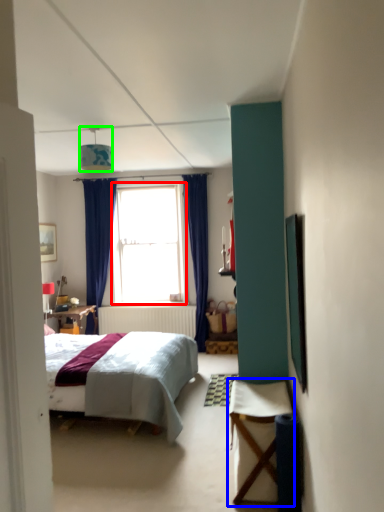
Question: Which object is the farthest from window (highlighted by a red box)? Choose among these: table (highlighted by a blue box) or lamp (highlighted by a green box).

Choices:
 (A) table
 (B) lamp

Answer: (A)